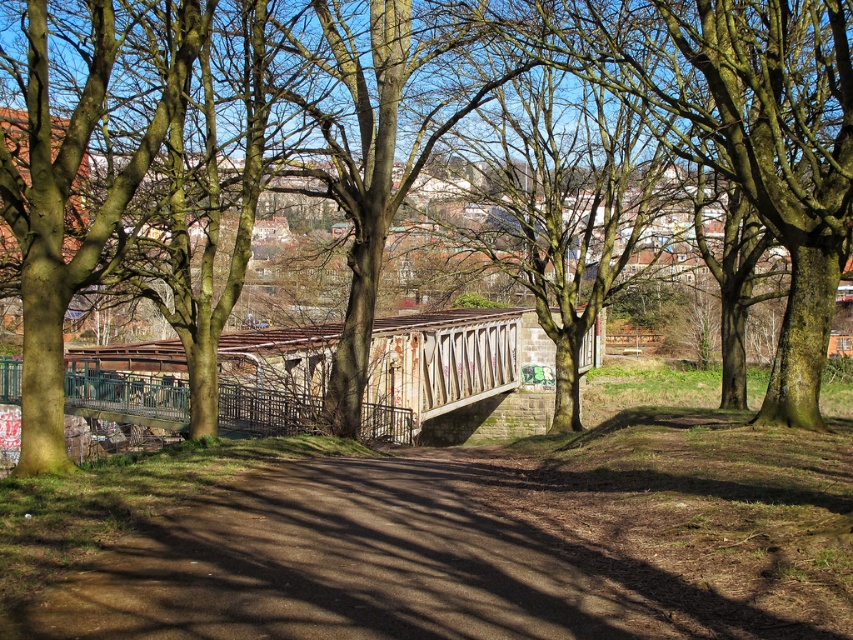
You are a hiker trying to cross the bridge. You need to know which is narrower between the brown dirt path at center and the brown textured tree at center. Which one should you choose?

The brown dirt path at center is thinner than the brown textured tree at center, so you should choose the brown dirt path at center as it is narrower.

You are standing at the starting point of the dirt path leading to the bridge. You see two points marked on the ground ahead of you. The first point is labeled as point (840, 451) and the second as point (599, 3). According to the scene, which point is closer to you as you face the bridge?

Point (840, 451) is in front of point (599, 3), so the first point is closer to you.